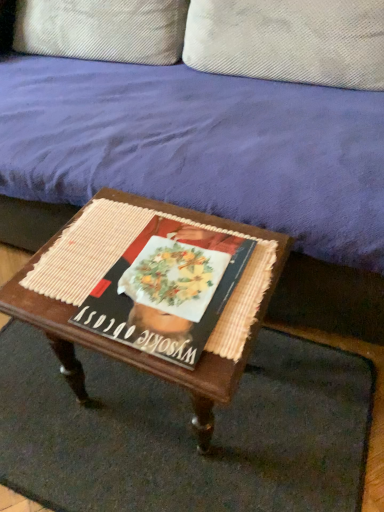
Find the location of `empty space that is ontop of matte paper magazine at center (from a real-world perspective)`. empty space that is ontop of matte paper magazine at center (from a real-world perspective) is located at coordinates (173, 277).